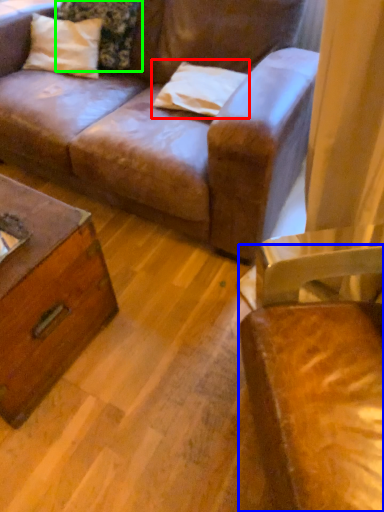
Question: Estimate the real-world distances between objects in this image. Which object is closer to pillow (highlighted by a red box), chair (highlighted by a blue box) or pillow (highlighted by a green box)?

Choices:
 (A) chair
 (B) pillow

Answer: (B)